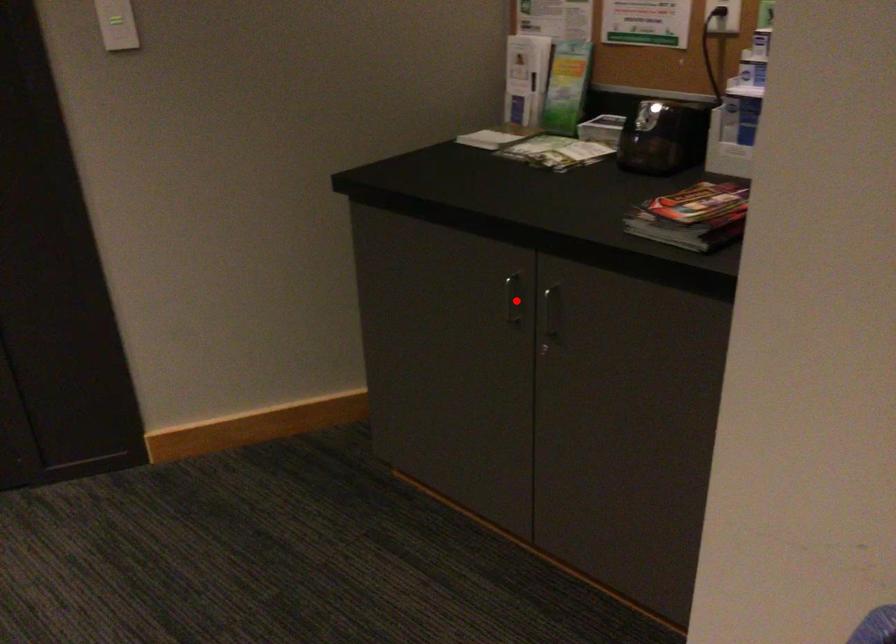
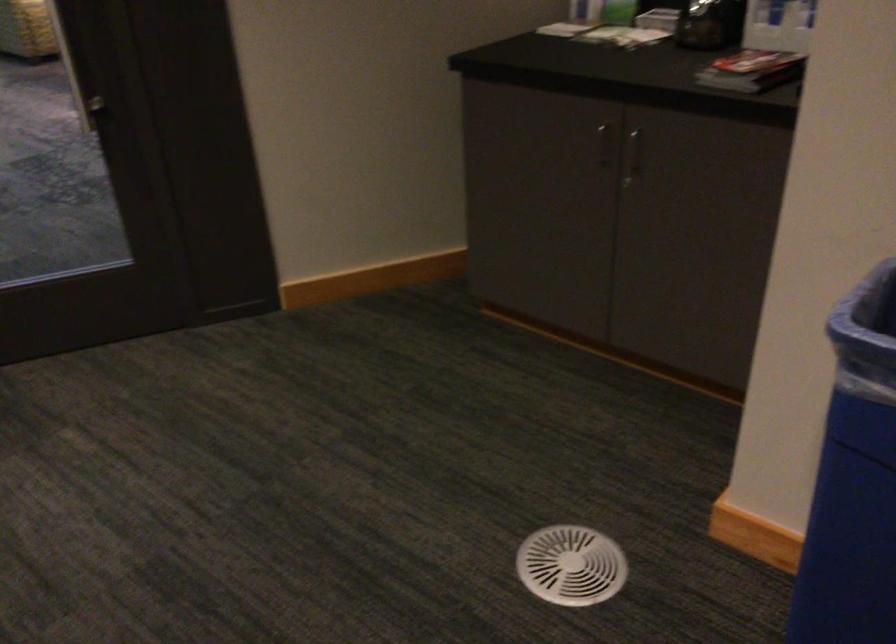
Question: I am providing you with two images of the same scene from different viewpoints. A red point is shown in image1. For the corresponding object point in image2, is it positioned nearer or farther from the camera?

Choices:
 (A) Nearer
 (B) Farther

Answer: (B)